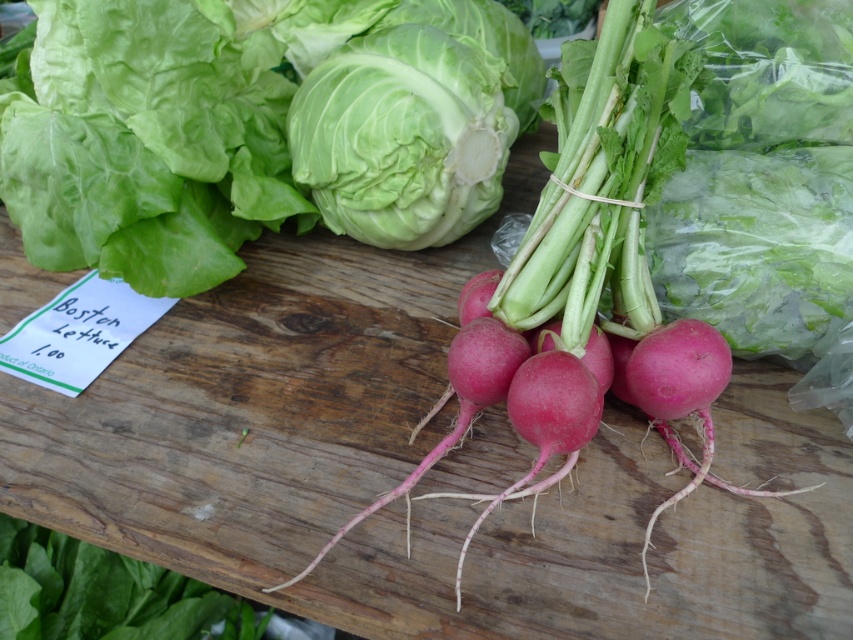
You are a customer at the market stall looking at the vegetables on the rustic wooden table. You want to grab the white crisp lettuce at center but need to reach around the smooth red radish at center. Can you tell me if the lettuce is behind or in front of the radish?

The smooth red radish at center is in front of the white crisp lettuce at center, so the lettuce is behind the radish.